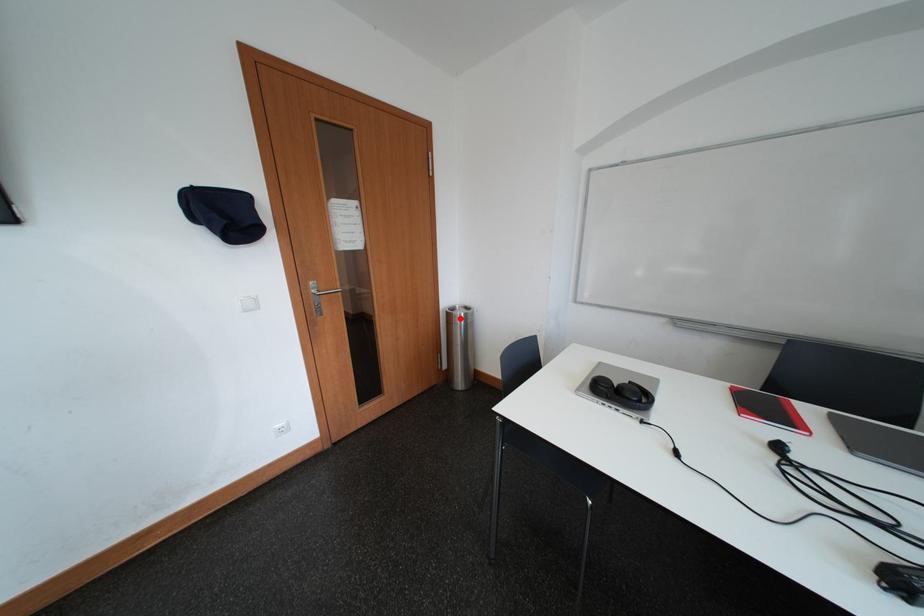
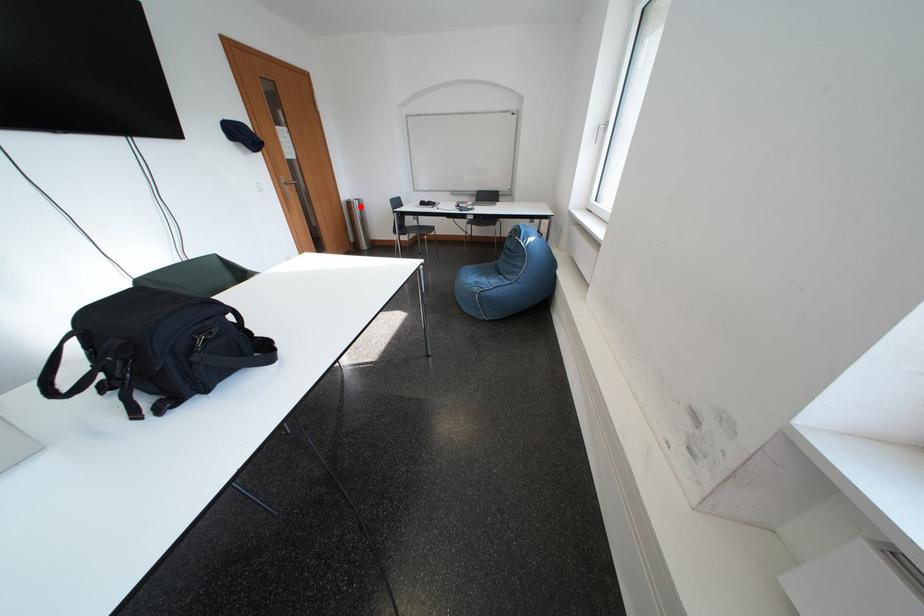
I am providing you with two images of the same scene from different viewpoints. A red point is marked on the first image and another point is marked on the second image. Do the highlighted points in image1 and image2 indicate the same real-world spot?

Yes